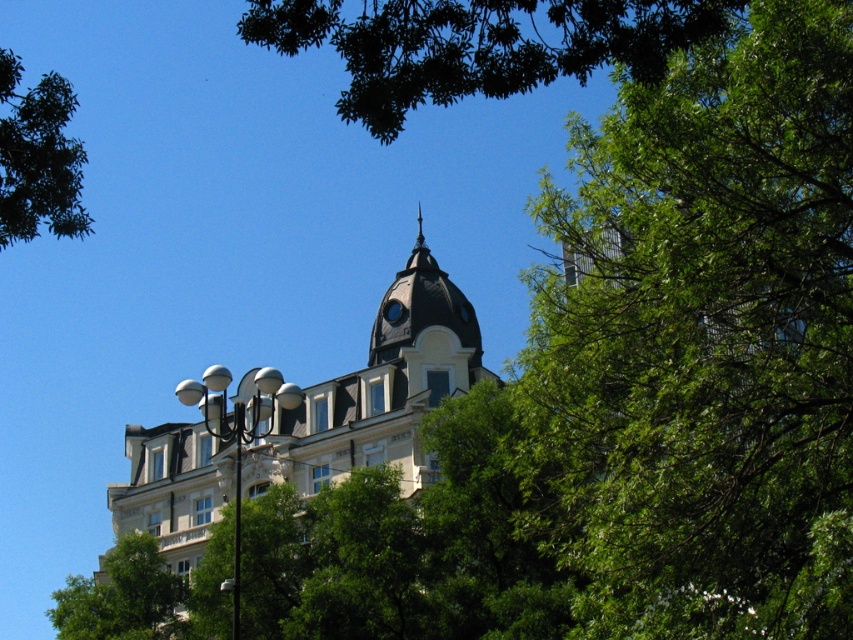
You are a photographer standing in front of the scene. You want to capture a photo where the white stone building at center is visible above the green leafy tree at upper center. Is this possible based on their positions?

The white stone building at center is located below the green leafy tree at upper center, so it would not be possible to capture the white stone building at center above the green leafy tree at upper center in the photo.